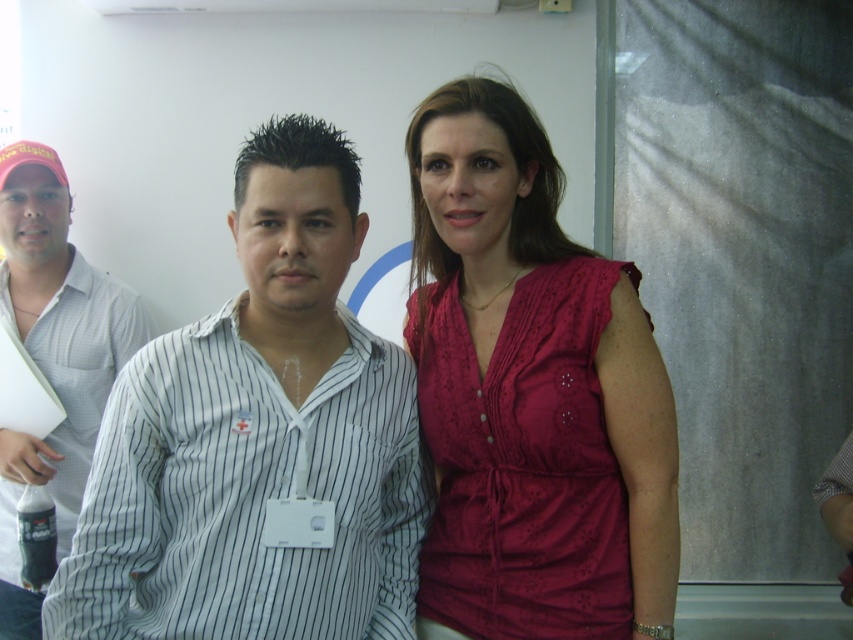
Can you confirm if matte pink blouse at center is positioned to the right of white striped shirt at left?

Correct, you'll find matte pink blouse at center to the right of white striped shirt at left.

Is matte pink blouse at center positioned in front of white striped shirt at left?

That is True.

Find the location of a particular element. Image resolution: width=853 pixels, height=640 pixels. matte pink blouse at center is located at coordinates (531, 394).

This screenshot has width=853, height=640. In order to click on matte pink blouse at center in this screenshot , I will do `click(531, 394)`.

Which is below, white striped shirt at center or matte pink blouse at center?

Positioned lower is white striped shirt at center.

Describe the element at coordinates (258, 440) in the screenshot. I see `white striped shirt at center` at that location.

Image resolution: width=853 pixels, height=640 pixels. What are the coordinates of `white striped shirt at center` in the screenshot? It's located at (258, 440).

Image resolution: width=853 pixels, height=640 pixels. In order to click on white striped shirt at center in this screenshot , I will do `click(258, 440)`.

Who is higher up, white striped shirt at center or white striped shirt at left?

Positioned higher is white striped shirt at center.

Does white striped shirt at center have a lesser width compared to white striped shirt at left?

No.

Who is more distant from viewer, (262,198) or (0,592)?

The point (0,592) is more distant.

Locate an element on the screen. The height and width of the screenshot is (640, 853). white striped shirt at center is located at coordinates (258, 440).